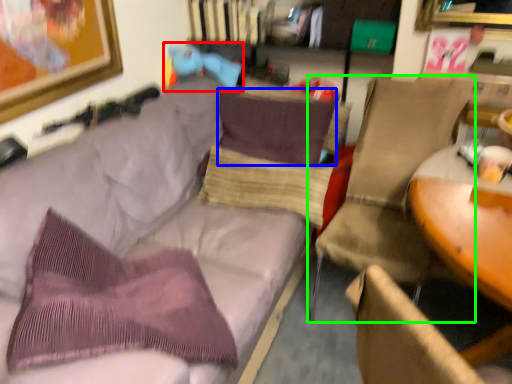
Question: Estimate the real-world distances between objects in this image. Which object is closer to toy (highlighted by a red box), pillow (highlighted by a blue box) or chair (highlighted by a green box)?

Choices:
 (A) pillow
 (B) chair

Answer: (A)